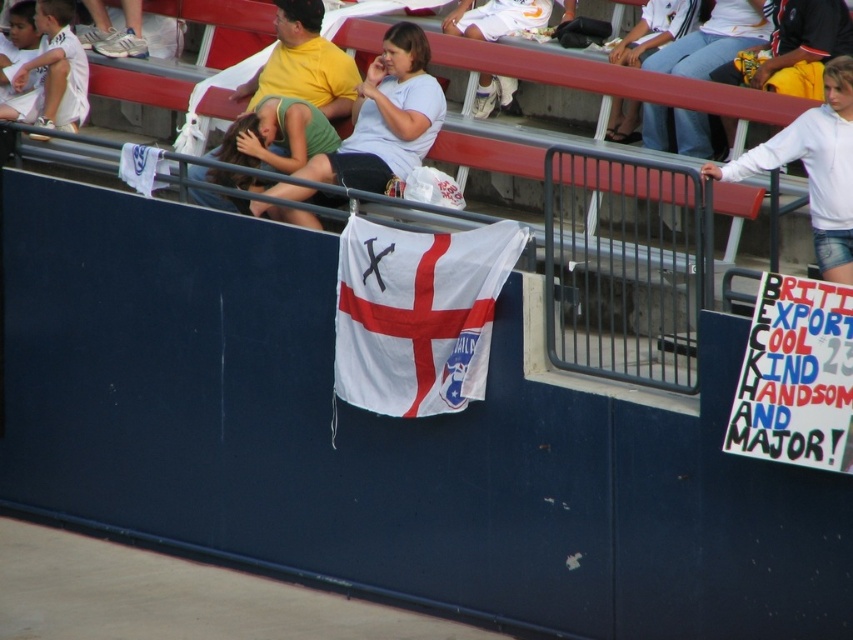
You are a photographer standing in the stadium and want to take a photo of the white cotton shirt at upper right and the yellow cotton shirt at upper center. Which shirt will appear closer to the camera in the photo?

The white cotton shirt at upper right will appear closer to the camera because it is in front of the yellow cotton shirt at upper center.

Based on the scene described, what is located at the coordinates point (x=386, y=116)?

The green jersey at center is located at point (x=386, y=116).